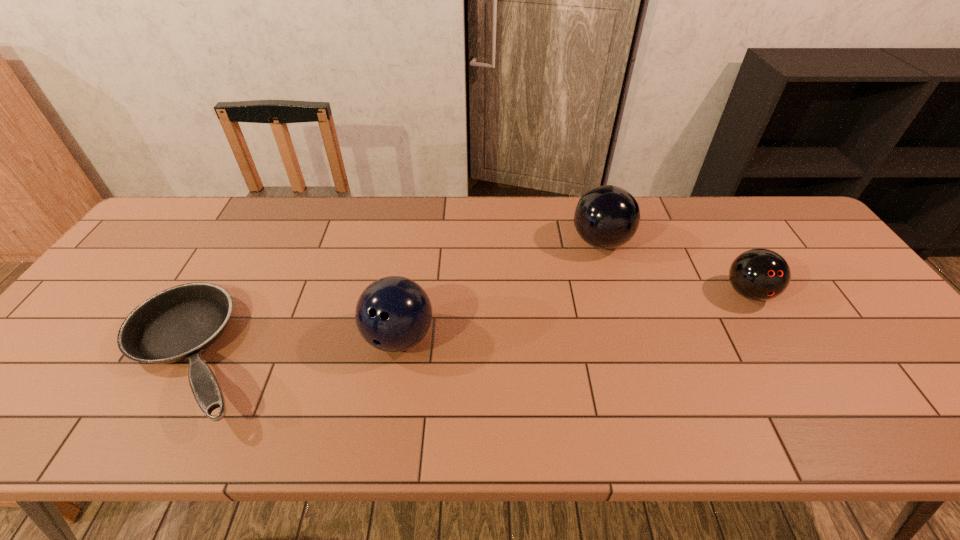
Where is `free space located on the surface of the second object from left to right near the finger holes`? free space located on the surface of the second object from left to right near the finger holes is located at coordinates (383, 438).

What are the coordinates of `free region located on the surface of the rightmost object near the finger holes` in the screenshot? It's located at (774, 337).

At what (x,y) coordinates should I click in order to perform the action: click on free space located 0.330m on the back of the frying pan. Please return your answer as a coordinate pair (x, y). The image size is (960, 540). Looking at the image, I should click on (268, 218).

This screenshot has height=540, width=960. I want to click on object present at the far edge, so click(606, 217).

Locate an element on the screen. object that is positioned at the near edge is located at coordinates (179, 323).

Image resolution: width=960 pixels, height=540 pixels. What are the coordinates of `vacant space at the far edge of the desktop` in the screenshot? It's located at (740, 210).

Find the location of a particular element. The width and height of the screenshot is (960, 540). vacant space at the near edge of the desktop is located at coordinates (99, 404).

I want to click on vacant space at the left edge of the desktop, so (110, 356).

The height and width of the screenshot is (540, 960). What are the coordinates of `vacant space at the near left corner of the desktop` in the screenshot? It's located at (23, 420).

Find the location of a particular element. free spot at the near right corner of the desktop is located at coordinates (950, 406).